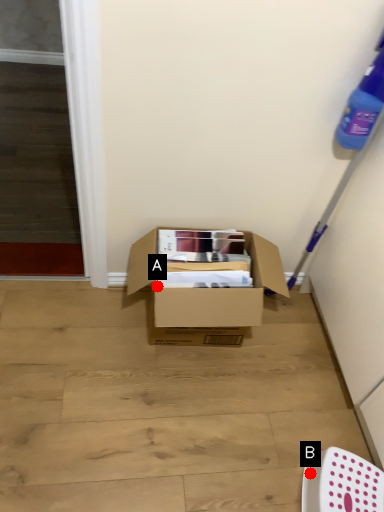
Question: Two points are circled on the image, labeled by A and B beside each circle. Among these points, which one is farthest from the camera?

Choices:
 (A) A is further
 (B) B is further

Answer: (A)